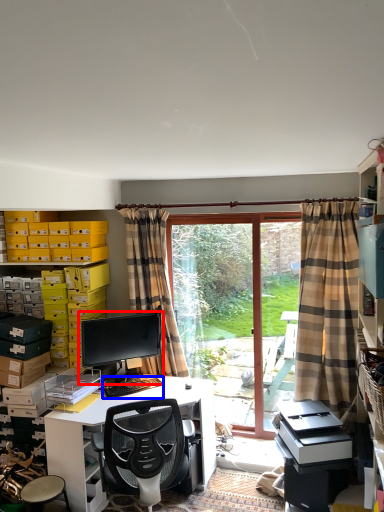
Question: Which of the following is the farthest to the observer, computer monitor (highlighted by a red box) or computer keyboard (highlighted by a blue box)?

Choices:
 (A) computer monitor
 (B) computer keyboard

Answer: (A)